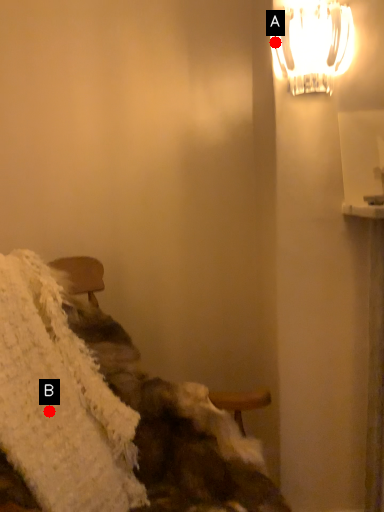
Question: Two points are circled on the image, labeled by A and B beside each circle. Which point appears closest to the camera in this image?

Choices:
 (A) A is closer
 (B) B is closer

Answer: (B)